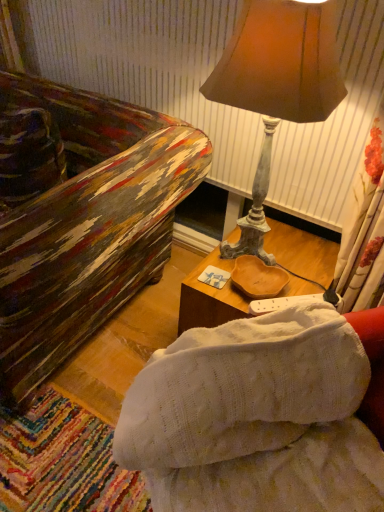
Question: Is wooden tray at center positioned far away from white knitted studio couch at center?

Choices:
 (A) no
 (B) yes

Answer: (A)

Question: Is wooden tray at center smaller than white knitted studio couch at center?

Choices:
 (A) yes
 (B) no

Answer: (A)

Question: From the image's perspective, is wooden tray at center on white knitted studio couch at center?

Choices:
 (A) yes
 (B) no

Answer: (A)

Question: Does wooden tray at center have a lesser height compared to white knitted studio couch at center?

Choices:
 (A) yes
 (B) no

Answer: (A)

Question: Is wooden tray at center beside white knitted studio couch at center?

Choices:
 (A) no
 (B) yes

Answer: (A)

Question: Looking at their shapes, would you say matte brown lampshade at upper right is wider or thinner than wooden tray at center?

Choices:
 (A) thin
 (B) wide

Answer: (A)

Question: Would you say matte brown lampshade at upper right is to the left or to the right of wooden tray at center in the picture?

Choices:
 (A) left
 (B) right

Answer: (A)

Question: Based on their sizes in the image, would you say matte brown lampshade at upper right is bigger or smaller than wooden tray at center?

Choices:
 (A) big
 (B) small

Answer: (A)

Question: Choose the correct answer: Is matte brown lampshade at upper right inside wooden tray at center or outside it?

Choices:
 (A) inside
 (B) outside

Answer: (B)

Question: Considering the positions of white knitted studio couch at center and wooden tray at center in the image, is white knitted studio couch at center wider or thinner than wooden tray at center?

Choices:
 (A) wide
 (B) thin

Answer: (B)

Question: In the image, is white knitted studio couch at center positioned in front of or behind wooden tray at center?

Choices:
 (A) behind
 (B) front

Answer: (B)

Question: Considering the relative positions of white knitted studio couch at center and wooden tray at center in the image provided, is white knitted studio couch at center to the left or to the right of wooden tray at center?

Choices:
 (A) left
 (B) right

Answer: (A)

Question: From a real-world perspective, is white knitted studio couch at center above or below wooden tray at center?

Choices:
 (A) above
 (B) below

Answer: (A)

Question: Is matte brown lampshade at upper right taller or shorter than white knitted studio couch at center?

Choices:
 (A) short
 (B) tall

Answer: (B)

Question: Would you say matte brown lampshade at upper right is inside or outside white knitted studio couch at center?

Choices:
 (A) outside
 (B) inside

Answer: (A)